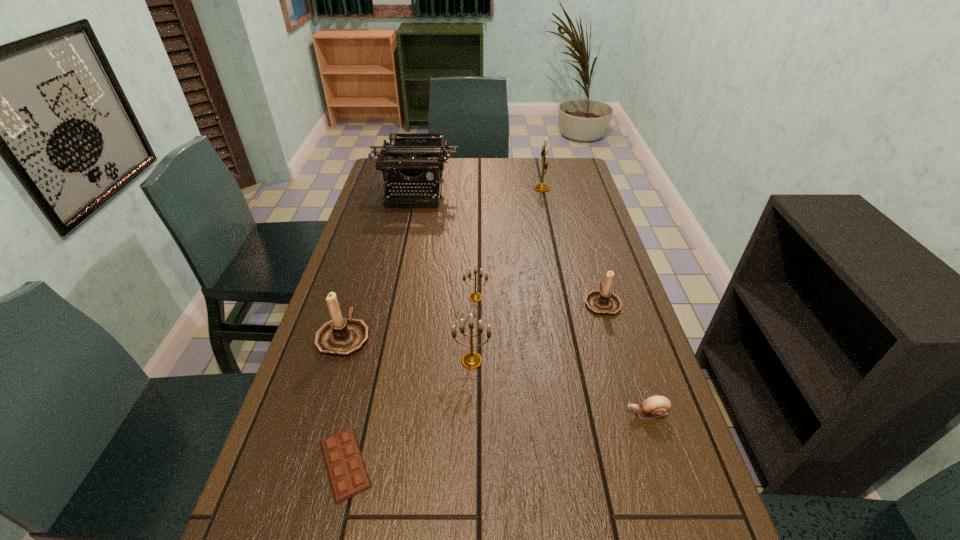
Where is `free space located on the front-facing side of the second nearest object`? free space located on the front-facing side of the second nearest object is located at coordinates (509, 414).

The height and width of the screenshot is (540, 960). I want to click on blank space located 0.200m on the front-facing side of the second nearest object, so click(x=536, y=414).

The width and height of the screenshot is (960, 540). In order to click on free point located 0.070m on the left of the shortest object in this screenshot , I will do `click(278, 463)`.

This screenshot has height=540, width=960. I want to click on candelabrum at the far edge, so coord(540,187).

What are the coordinates of `typewriter that is at the far edge` in the screenshot? It's located at (409, 159).

Locate an element on the screen. typewriter that is at the left edge is located at coordinates (409, 159).

Identify the location of candle holder situated at the left edge. (343, 337).

Where is `chocolate bar located in the left edge section of the desktop`? chocolate bar located in the left edge section of the desktop is located at coordinates (347, 472).

Locate an element on the screen. This screenshot has width=960, height=540. escargot located at the right edge is located at coordinates (656, 406).

The image size is (960, 540). I want to click on object located at the far left corner, so click(409, 159).